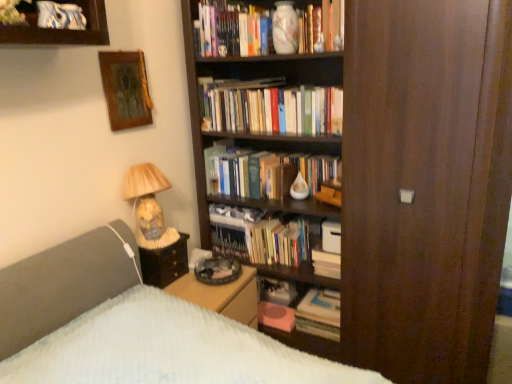
The image size is (512, 384). Identify the location of empty space that is ontop of wooden side table at lower left (from a real-world perspective). (160, 240).